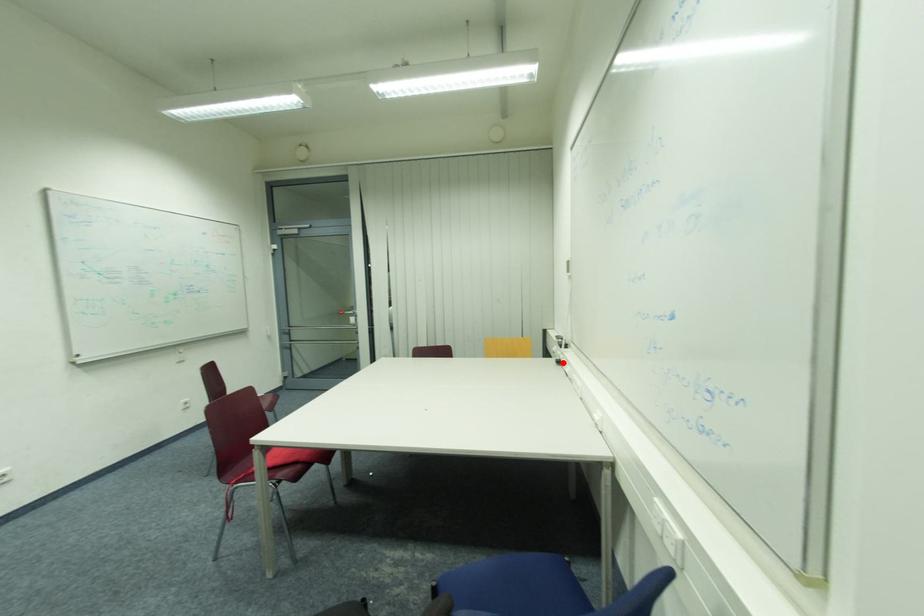
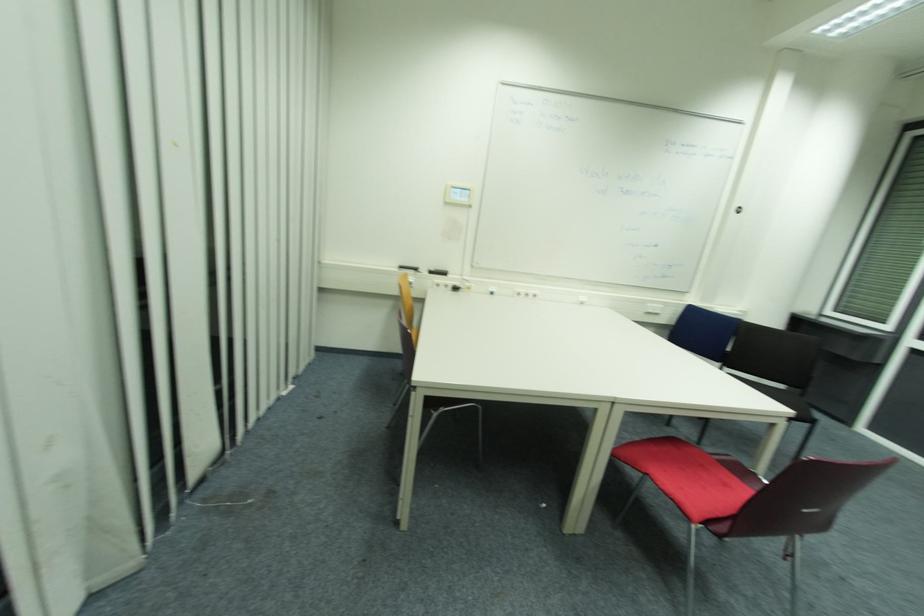
Question: I am providing you with two images of the same scene from different viewpoints. A red point is shown in image1. For the corresponding object point in image2, is it positioned nearer or farther from the camera?

Choices:
 (A) Nearer
 (B) Farther

Answer: (B)